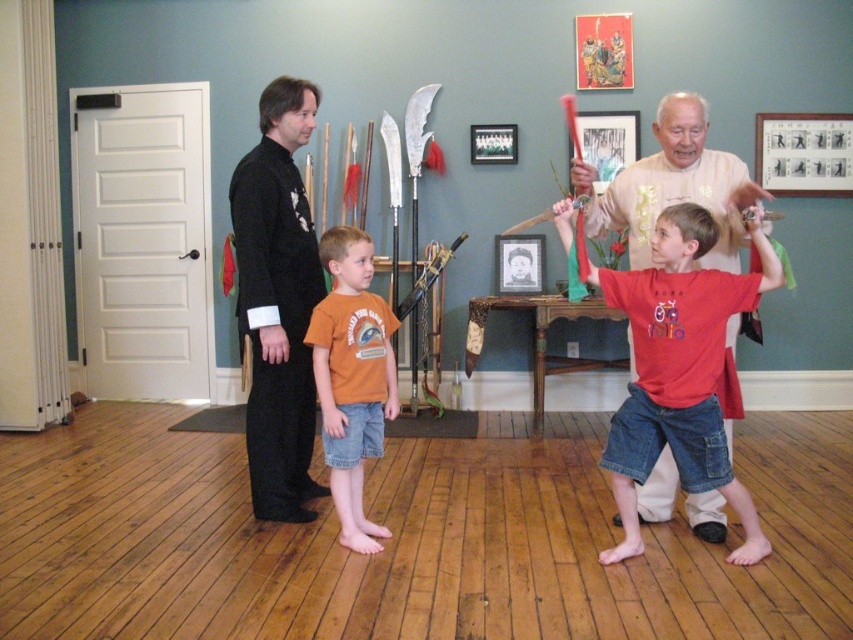
Question: Does orange cotton t-shirt at center lie behind matte black picture frame at upper right?

Choices:
 (A) no
 (B) yes

Answer: (A)

Question: Based on their relative distances, which object is farther from the matte beige shirt at center?

Choices:
 (A) orange cotton t-shirt at center
 (B) black silk kimono at left
 (C) black matte picture frame at upper center
 (D) black paper picture frame at center

Answer: (C)

Question: Does matte beige shirt at center appear on the right side of orange cotton t-shirt at center?

Choices:
 (A) yes
 (B) no

Answer: (A)

Question: Which point is farther to the camera?

Choices:
 (A) (476, 129)
 (B) (816, 131)
 (C) (602, 160)
 (D) (727, 429)

Answer: (A)

Question: Considering the relative positions of black paper picture frame at center and black matte picture frame at upper center in the image provided, where is black paper picture frame at center located with respect to black matte picture frame at upper center?

Choices:
 (A) right
 (B) left

Answer: (A)

Question: Which of the following is the closest to the observer?

Choices:
 (A) (529, 246)
 (B) (659, 497)
 (C) (354, 252)
 (D) (289, 433)

Answer: (C)